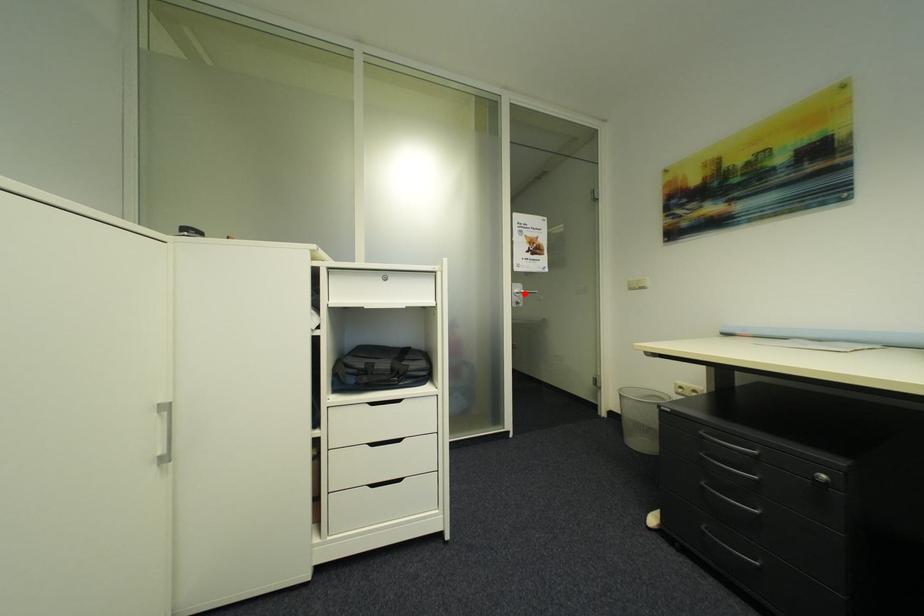
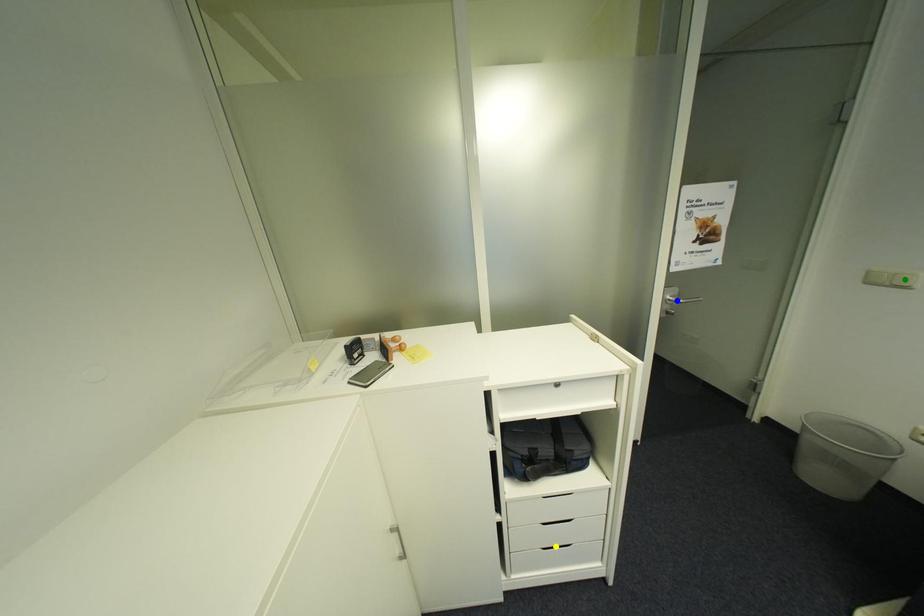
Question: I am providing you with two images of the same scene from different viewpoints. A red point is marked on the first image. You are given multiple points on the second image. Which spot in image 2 lines up with the point in image 1?

Choices:
 (A) blue point
 (B) green point
 (C) yellow point

Answer: (A)